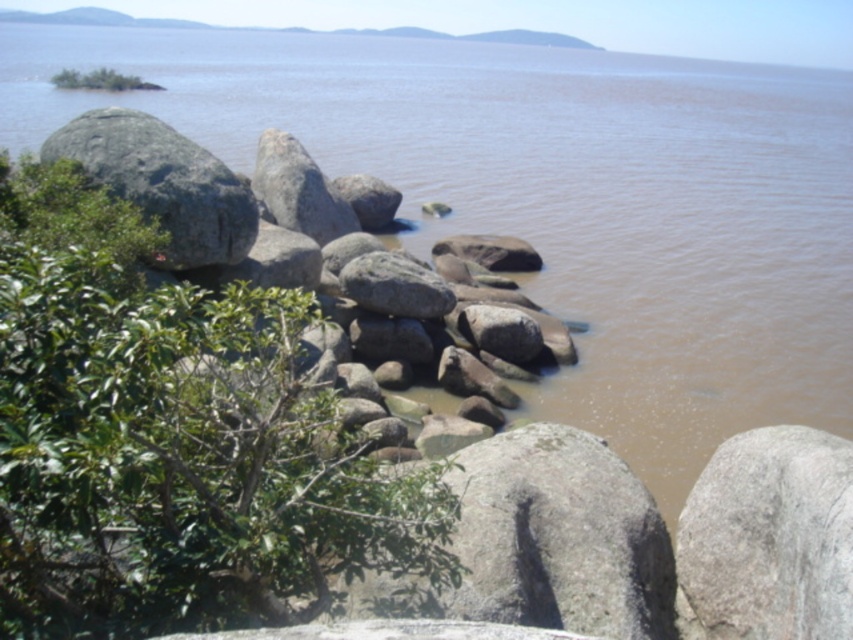
Question: Which object is the farthest from the gray granite rocks at center?

Choices:
 (A) gray rough rock at left
 (B) gray rough rock at center

Answer: (B)

Question: Observing the image, what is the correct spatial positioning of gray rough rock at center in reference to gray rough rock at left?

Choices:
 (A) left
 (B) right

Answer: (B)

Question: Which point is closer to the camera?

Choices:
 (A) gray rough rock at center
 (B) gray granite rocks at center
 (C) gray rough rock at left

Answer: (A)

Question: Can you confirm if gray rough rock at center is thinner than gray granite rocks at center?

Choices:
 (A) yes
 (B) no

Answer: (A)

Question: Can you confirm if gray rough rock at center is bigger than gray rough rock at left?

Choices:
 (A) yes
 (B) no

Answer: (A)

Question: Which of the following is the closest to the observer?

Choices:
 (A) gray rough rock at center
 (B) gray rough rock at left
 (C) gray granite rocks at center

Answer: (A)